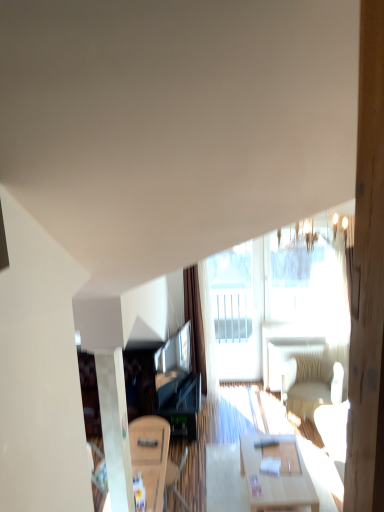
Question: From the image's perspective, is transparent glass door at center above or below brown fabric curtain at center?

Choices:
 (A) below
 (B) above

Answer: (B)

Question: Would you say transparent glass door at center is inside or outside brown fabric curtain at center?

Choices:
 (A) outside
 (B) inside

Answer: (A)

Question: Estimate the real-world distances between objects in this image. Which object is closer to the white fabric armchair at right?

Choices:
 (A) matte black entertainment center at center
 (B) transparent glass window at upper center
 (C) brown fabric curtain at center
 (D) light wood table at center, the 1th table when ordered from right to left
 (E) transparent glass door at center

Answer: (B)

Question: Which object is positioned closest to the light wood table at center, the second table positioned from the left?

Choices:
 (A) transparent glass door at center
 (B) wooden table at lower left, which is counted as the 1th table, starting from the left
 (C) brown fabric curtain at center
 (D) transparent glass window at upper center
 (E) matte black entertainment center at center

Answer: (B)